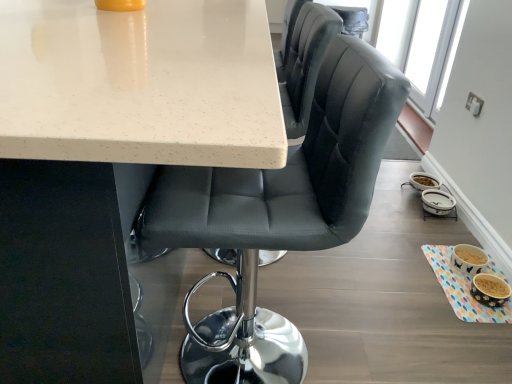
Question: From a real-world perspective, is transparent glass window screen at upper right positioned under white speckled laminate table at upper center based on gravity?

Choices:
 (A) no
 (B) yes

Answer: (A)

Question: From the image's perspective, is transparent glass window screen at upper right located beneath white speckled laminate table at upper center?

Choices:
 (A) yes
 (B) no

Answer: (B)

Question: Is transparent glass window screen at upper right further to the viewer compared to white speckled laminate table at upper center?

Choices:
 (A) yes
 (B) no

Answer: (A)

Question: Is transparent glass window screen at upper right aimed at white speckled laminate table at upper center?

Choices:
 (A) yes
 (B) no

Answer: (B)

Question: Is transparent glass window screen at upper right wider than white speckled laminate table at upper center?

Choices:
 (A) yes
 (B) no

Answer: (B)

Question: Can you confirm if transparent glass window screen at upper right is taller than white speckled laminate table at upper center?

Choices:
 (A) yes
 (B) no

Answer: (B)

Question: Does transparent glass window screen at upper right come behind matte black chair at center?

Choices:
 (A) yes
 (B) no

Answer: (A)

Question: Is transparent glass window screen at upper right thinner than matte black chair at center?

Choices:
 (A) no
 (B) yes

Answer: (B)

Question: Is transparent glass window screen at upper right aimed at matte black chair at center?

Choices:
 (A) no
 (B) yes

Answer: (A)

Question: Is transparent glass window screen at upper right positioned with its back to matte black chair at center?

Choices:
 (A) no
 (B) yes

Answer: (A)

Question: Are transparent glass window screen at upper right and matte black chair at center beside each other?

Choices:
 (A) no
 (B) yes

Answer: (A)

Question: From a real-world perspective, is transparent glass window screen at upper right physically above matte black chair at center?

Choices:
 (A) no
 (B) yes

Answer: (A)

Question: Can you confirm if white speckled laminate table at upper center is wider than matte black chair at center?

Choices:
 (A) yes
 (B) no

Answer: (A)